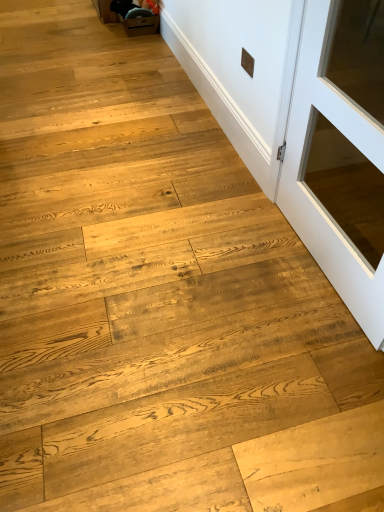
Measure the distance between point (302, 139) and camera.

1.70 meters.

Locate an element on the screen. Image resolution: width=384 pixels, height=512 pixels. white glossy door at right is located at coordinates pyautogui.click(x=340, y=152).

The height and width of the screenshot is (512, 384). Describe the element at coordinates (340, 152) in the screenshot. I see `white glossy door at right` at that location.

I want to click on white glossy door at right, so click(340, 152).